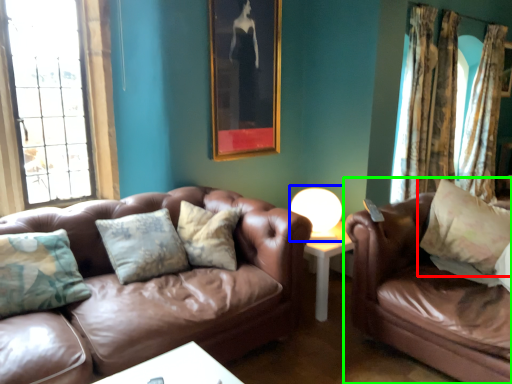
Question: Which is farther away from pillow (highlighted by a red box)? table lamp (highlighted by a blue box) or studio couch (highlighted by a green box)?

Choices:
 (A) table lamp
 (B) studio couch

Answer: (A)